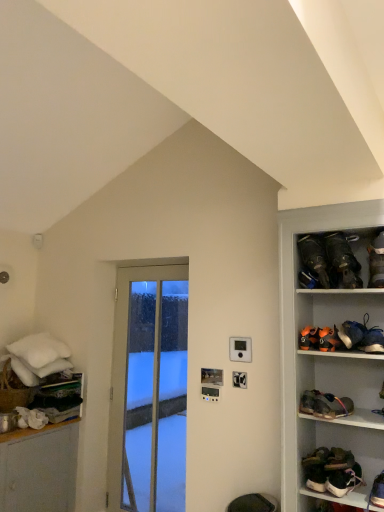
The height and width of the screenshot is (512, 384). I want to click on clear glass door at center, so pyautogui.click(x=149, y=390).

The width and height of the screenshot is (384, 512). Describe the element at coordinates (309, 401) in the screenshot. I see `leather brown shoe at lower right, the 7th footwear in the top-to-bottom sequence` at that location.

Where is `green suede shoes at lower right, acting as the 3th footwear starting from the bottom`? The width and height of the screenshot is (384, 512). green suede shoes at lower right, acting as the 3th footwear starting from the bottom is located at coordinates (316, 457).

This screenshot has width=384, height=512. I want to click on leather brown shoe at right, the 5th footwear from the bottom, so click(325, 405).

Consider the image. In order to face orange suede shoes at upper right, which ranks as the 5th footwear in top-to-bottom order, should I rotate leftwards or rightwards?

It's best to rotate right around 16.078 degrees.

The width and height of the screenshot is (384, 512). What do you see at coordinates (329, 339) in the screenshot?
I see `orange suede shoe at upper right, which is counted as the fourth footwear, starting from the top` at bounding box center [329, 339].

This screenshot has width=384, height=512. In order to click on white leather sneakers at lower right, which is the first footwear from bottom to top in this screenshot , I will do `click(332, 471)`.

Between black leather shoes at upper right, arranged as the first footwear when viewed from the top, and matte black shoe at lower right, acting as the ninth footwear starting from the top, which one has larger width?

With larger width is black leather shoes at upper right, arranged as the first footwear when viewed from the top.

Can you confirm if black leather shoes at upper right, arranged as the first footwear when viewed from the top, is bigger than matte black shoe at lower right, acting as the ninth footwear starting from the top?

Correct, black leather shoes at upper right, arranged as the first footwear when viewed from the top, is larger in size than matte black shoe at lower right, acting as the ninth footwear starting from the top.

From the image's perspective, which is above, black leather shoes at upper right, placed as the 10th footwear when sorted from bottom to top, or matte black shoe at lower right, which appears as the 2th footwear when ordered from the bottom?

From the image's view, black leather shoes at upper right, placed as the 10th footwear when sorted from bottom to top, is above.

Are orange suede shoe at upper right, positioned as the 7th footwear in bottom-to-top order, and leather brown shoe at right, placed as the sixth footwear when sorted from top to bottom, making contact?

No, orange suede shoe at upper right, positioned as the 7th footwear in bottom-to-top order, is not with leather brown shoe at right, placed as the sixth footwear when sorted from top to bottom.

How different are the orientations of orange suede shoe at upper right, which is counted as the fourth footwear, starting from the top, and leather brown shoe at right, the 5th footwear from the bottom, in degrees?

orange suede shoe at upper right, which is counted as the fourth footwear, starting from the top, and leather brown shoe at right, the 5th footwear from the bottom, are facing 15.1 degrees away from each other.

From a real-world perspective, does orange suede shoe at upper right, which is counted as the fourth footwear, starting from the top, sit lower than leather brown shoe at right, placed as the sixth footwear when sorted from top to bottom?

Incorrect, from a real-world perspective, orange suede shoe at upper right, which is counted as the fourth footwear, starting from the top, is higher than leather brown shoe at right, placed as the sixth footwear when sorted from top to bottom.

Which is in front, point (368, 284) or point (382, 233)?

Positioned in front is point (368, 284).

In the scene shown: Between brown suede boot at right, the 9th footwear positioned from the bottom, and black leather shoes at upper right, placed as the 10th footwear when sorted from bottom to top, which one has more height?

Standing taller between the two is black leather shoes at upper right, placed as the 10th footwear when sorted from bottom to top.

Based on the photo, is brown suede boot at right, the second footwear positioned from the top, directly adjacent to black leather shoes at upper right, placed as the 10th footwear when sorted from bottom to top?

No, brown suede boot at right, the second footwear positioned from the top, is not next to black leather shoes at upper right, placed as the 10th footwear when sorted from bottom to top.

How much distance is there between brown suede boot at right, the second footwear positioned from the top, and white leather sneakers at lower right, acting as the tenth footwear starting from the top?

The distance of brown suede boot at right, the second footwear positioned from the top, from white leather sneakers at lower right, acting as the tenth footwear starting from the top, is 35.63 inches.

Does brown suede boot at right, the second footwear positioned from the top, come behind white leather sneakers at lower right, acting as the tenth footwear starting from the top?

Yes.

From a real-world perspective, is brown suede boot at right, the 9th footwear positioned from the bottom, above or below white leather sneakers at lower right, acting as the tenth footwear starting from the top?

Clearly, from a real-world perspective, brown suede boot at right, the 9th footwear positioned from the bottom, is above white leather sneakers at lower right, acting as the tenth footwear starting from the top.

From the image's perspective, which one is positioned lower, brown suede boot at right, the second footwear positioned from the top, or white leather sneakers at lower right, acting as the tenth footwear starting from the top?

white leather sneakers at lower right, acting as the tenth footwear starting from the top, is shown below in the image.

Considering the relative sizes of white leather sneakers at lower right, which is the first footwear from bottom to top, and orange suede shoe at upper right, positioned as the 7th footwear in bottom-to-top order, in the image provided, is white leather sneakers at lower right, which is the first footwear from bottom to top, shorter than orange suede shoe at upper right, positioned as the 7th footwear in bottom-to-top order,?

Incorrect, the height of white leather sneakers at lower right, which is the first footwear from bottom to top, does not fall short of that of orange suede shoe at upper right, positioned as the 7th footwear in bottom-to-top order.

From the image's perspective, is white leather sneakers at lower right, which is the first footwear from bottom to top, below orange suede shoe at upper right, positioned as the 7th footwear in bottom-to-top order?

Correct, white leather sneakers at lower right, which is the first footwear from bottom to top, appears lower than orange suede shoe at upper right, positioned as the 7th footwear in bottom-to-top order, in the image.

Considering the relative positions of white leather sneakers at lower right, acting as the tenth footwear starting from the top, and orange suede shoe at upper right, positioned as the 7th footwear in bottom-to-top order, in the image provided, is white leather sneakers at lower right, acting as the tenth footwear starting from the top, to the left of orange suede shoe at upper right, positioned as the 7th footwear in bottom-to-top order, from the viewer's perspective?

No.

Between orange suede shoe at upper right, positioned as the 7th footwear in bottom-to-top order, and leather brown shoe at lower right, positioned as the fourth footwear in bottom-to-top order, which one has more height?

Standing taller between the two is orange suede shoe at upper right, positioned as the 7th footwear in bottom-to-top order.

Is orange suede shoe at upper right, which is counted as the fourth footwear, starting from the top, at the right side of leather brown shoe at lower right, positioned as the fourth footwear in bottom-to-top order?

Indeed, orange suede shoe at upper right, which is counted as the fourth footwear, starting from the top, is positioned on the right side of leather brown shoe at lower right, positioned as the fourth footwear in bottom-to-top order.

Is orange suede shoe at upper right, positioned as the 7th footwear in bottom-to-top order, with leather brown shoe at lower right, positioned as the fourth footwear in bottom-to-top order?

No, orange suede shoe at upper right, positioned as the 7th footwear in bottom-to-top order, is not next to leather brown shoe at lower right, positioned as the fourth footwear in bottom-to-top order.

Is orange suede shoe at upper right, positioned as the 7th footwear in bottom-to-top order, facing away from leather brown shoe at lower right, positioned as the fourth footwear in bottom-to-top order?

orange suede shoe at upper right, positioned as the 7th footwear in bottom-to-top order, does not have its back to leather brown shoe at lower right, positioned as the fourth footwear in bottom-to-top order.

Does point (347, 486) come farther from viewer compared to point (374, 250)?

No, it is not.

Which of these two, white leather sneakers at lower right, acting as the tenth footwear starting from the top, or brown suede boot at right, the second footwear positioned from the top, is smaller?

white leather sneakers at lower right, acting as the tenth footwear starting from the top, is smaller.

From the image's perspective, is white leather sneakers at lower right, acting as the tenth footwear starting from the top, beneath brown suede boot at right, the 9th footwear positioned from the bottom?

Correct, white leather sneakers at lower right, acting as the tenth footwear starting from the top, appears lower than brown suede boot at right, the 9th footwear positioned from the bottom, in the image.

Locate an element on the screen. The width and height of the screenshot is (384, 512). footwear that is the 3rd object located in front of the black leather shoes at upper right, arranged as the first footwear when viewed from the top is located at coordinates 377,490.

From the image's perspective, which footwear is the 2nd one above the leather brown shoe at right, placed as the sixth footwear when sorted from top to bottom? Please provide its 2D coordinates.

[(329, 339)]

Which object lies further to the anchor point white leather sneakers at lower right, acting as the tenth footwear starting from the top, matte black shoe at lower right, acting as the ninth footwear starting from the top, or green suede shoes at lower right, acting as the 3th footwear starting from the bottom?

matte black shoe at lower right, acting as the ninth footwear starting from the top, lies further to white leather sneakers at lower right, acting as the tenth footwear starting from the top, than the other object.

Based on their spatial positions, is dark brown leather shoes at upper right, the 8th footwear when ordered from bottom to top, or leather brown shoe at lower right, positioned as the fourth footwear in bottom-to-top order, closer to white leather sneakers at lower right, which is the first footwear from bottom to top?

The object closer to white leather sneakers at lower right, which is the first footwear from bottom to top, is leather brown shoe at lower right, positioned as the fourth footwear in bottom-to-top order.

Consider the image. Estimate the real-world distances between objects in this image. Which object is further from matte black shoe at lower right, which appears as the 2th footwear when ordered from the bottom, orange suede shoe at upper right, positioned as the 7th footwear in bottom-to-top order, or leather brown shoe at lower right, positioned as the fourth footwear in bottom-to-top order?

Among the two, orange suede shoe at upper right, positioned as the 7th footwear in bottom-to-top order, is located further to matte black shoe at lower right, which appears as the 2th footwear when ordered from the bottom.

Based on their spatial positions, is leather brown shoe at lower right, the 7th footwear in the top-to-bottom sequence, or orange suede shoes at upper right, arranged as the 6th footwear when ordered from the bottom, closer to brown suede boot at right, the second footwear positioned from the top?

orange suede shoes at upper right, arranged as the 6th footwear when ordered from the bottom, lies closer to brown suede boot at right, the second footwear positioned from the top, than the other object.

Based on their spatial positions, is dark brown leather shoes at upper right, the 8th footwear when ordered from bottom to top, or matte black shoe at lower right, acting as the ninth footwear starting from the top, further from orange suede shoes at upper right, which ranks as the 5th footwear in top-to-bottom order?

Based on the image, matte black shoe at lower right, acting as the ninth footwear starting from the top, appears to be further to orange suede shoes at upper right, which ranks as the 5th footwear in top-to-bottom order.

Considering their positions, is black leather shoes at upper right, arranged as the first footwear when viewed from the top, positioned further to brown suede boot at right, the second footwear positioned from the top, than leather brown shoe at right, the 5th footwear from the bottom?

leather brown shoe at right, the 5th footwear from the bottom, lies further to brown suede boot at right, the second footwear positioned from the top, than the other object.

Which object lies nearer to the anchor point leather brown shoe at lower right, positioned as the fourth footwear in bottom-to-top order, green suede shoes at lower right, placed as the eighth footwear when sorted from top to bottom, or matte black shoe at lower right, which appears as the 2th footwear when ordered from the bottom?

Based on the image, green suede shoes at lower right, placed as the eighth footwear when sorted from top to bottom, appears to be nearer to leather brown shoe at lower right, positioned as the fourth footwear in bottom-to-top order.

When comparing their distances from orange suede shoe at upper right, which is counted as the fourth footwear, starting from the top, does brown suede boot at right, the 9th footwear positioned from the bottom, or orange suede shoes at upper right, arranged as the 6th footwear when ordered from the bottom, seem closer?

The object closer to orange suede shoe at upper right, which is counted as the fourth footwear, starting from the top, is orange suede shoes at upper right, arranged as the 6th footwear when ordered from the bottom.

The image size is (384, 512). In order to click on door between dark brown leather shoes at upper right, which is the third footwear in top-to-bottom order, and white leather sneakers at lower right, which is the first footwear from bottom to top, vertically in this screenshot , I will do `click(149, 390)`.

Locate an element on the screen. The height and width of the screenshot is (512, 384). footwear between leather brown shoe at lower right, positioned as the fourth footwear in bottom-to-top order, and matte black shoe at lower right, acting as the ninth footwear starting from the top, in the up-down direction is located at coordinates (316, 457).

Locate an element on the screen. The image size is (384, 512). footwear between brown suede boot at right, the 9th footwear positioned from the bottom, and orange suede shoe at upper right, which is counted as the fourth footwear, starting from the top, in the vertical direction is located at coordinates (314, 259).

Find the location of a particular element. footwear between leather brown shoe at right, placed as the sixth footwear when sorted from top to bottom, and green suede shoes at lower right, acting as the 3th footwear starting from the bottom, in the vertical direction is located at coordinates (309, 401).